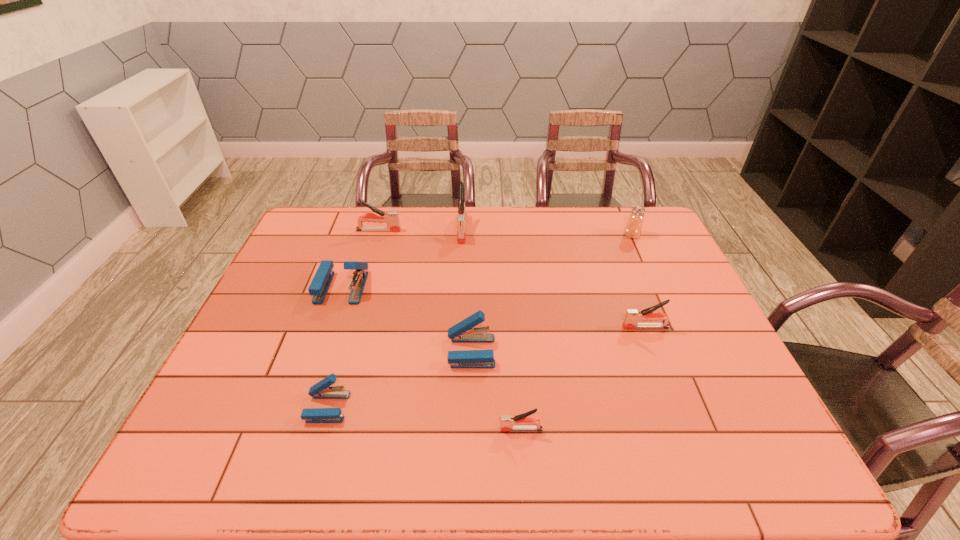
At what (x,y) coordinates should I click in order to perform the action: click on the nearest stapler. Please return your answer as a coordinate pair (x, y). Looking at the image, I should click on (522, 422).

Identify the location of the nearest gray stapler. The width and height of the screenshot is (960, 540). (522, 422).

Image resolution: width=960 pixels, height=540 pixels. In order to click on the nearest blue stapler in this screenshot , I will do `click(322, 390)`.

I want to click on the smallest blue stapler, so pyautogui.click(x=322, y=390).

Find the location of a particular element. Image resolution: width=960 pixels, height=540 pixels. free location located 0.080m on the handle side of the third gray stapler from right to left is located at coordinates (461, 259).

Where is `vacant space located on the handle side of the third smallest gray stapler`? vacant space located on the handle side of the third smallest gray stapler is located at coordinates (496, 231).

Find the location of a particular element. This screenshot has width=960, height=540. free region located 0.060m on the front of the farthest blue stapler is located at coordinates (330, 320).

The height and width of the screenshot is (540, 960). In order to click on vacant space located on the left of the saltshaker in this screenshot , I will do `click(559, 235)`.

Locate an element on the screen. The image size is (960, 540). free space located on the handle side of the rightmost gray stapler is located at coordinates (529, 327).

At what (x,y) coordinates should I click in order to perform the action: click on free spot located on the handle side of the rightmost gray stapler. Please return your answer as a coordinate pair (x, y). The width and height of the screenshot is (960, 540). Looking at the image, I should click on (507, 327).